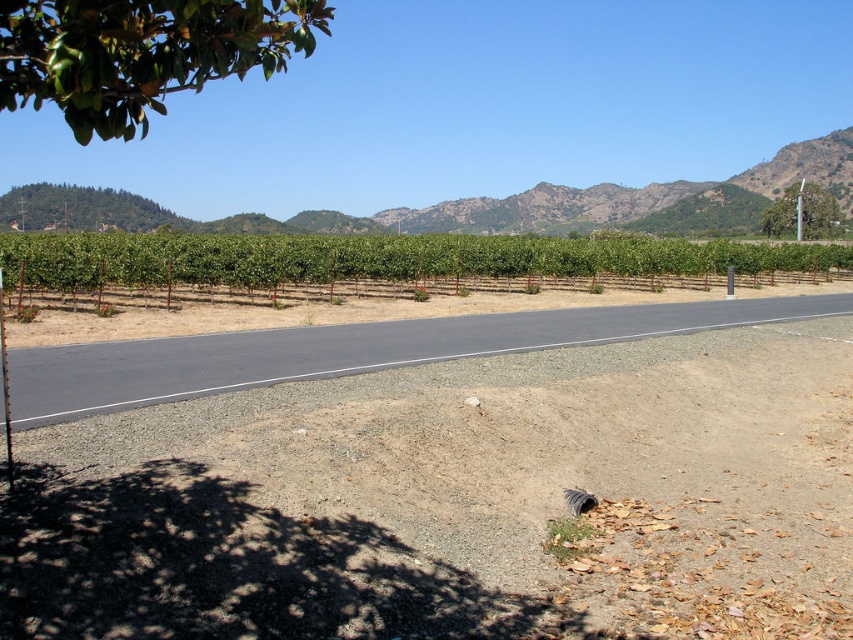
Question: Which object appears closest to the camera in this image?

Choices:
 (A) green leafy vines at center
 (B) green leafy tree at upper right
 (C) green leafy mountain at upper center
 (D) green glossy leaves at upper left

Answer: (D)

Question: In this image, where is green leafy mountain at upper center located relative to green leafy tree at upper right?

Choices:
 (A) below
 (B) above

Answer: (B)

Question: Which point is farther from the camera taking this photo?

Choices:
 (A) (810, 188)
 (B) (834, 157)
 (C) (262, 56)

Answer: (B)

Question: From the image, what is the correct spatial relationship of green leafy vines at center in relation to green leafy tree at upper right?

Choices:
 (A) above
 (B) below

Answer: (B)

Question: Is green leafy mountain at upper center wider than green leafy tree at upper right?

Choices:
 (A) yes
 (B) no

Answer: (A)

Question: Which object is closer to the camera taking this photo?

Choices:
 (A) green leafy tree at upper right
 (B) green leafy vines at center
 (C) green leafy mountain at upper center
 (D) green glossy leaves at upper left

Answer: (D)